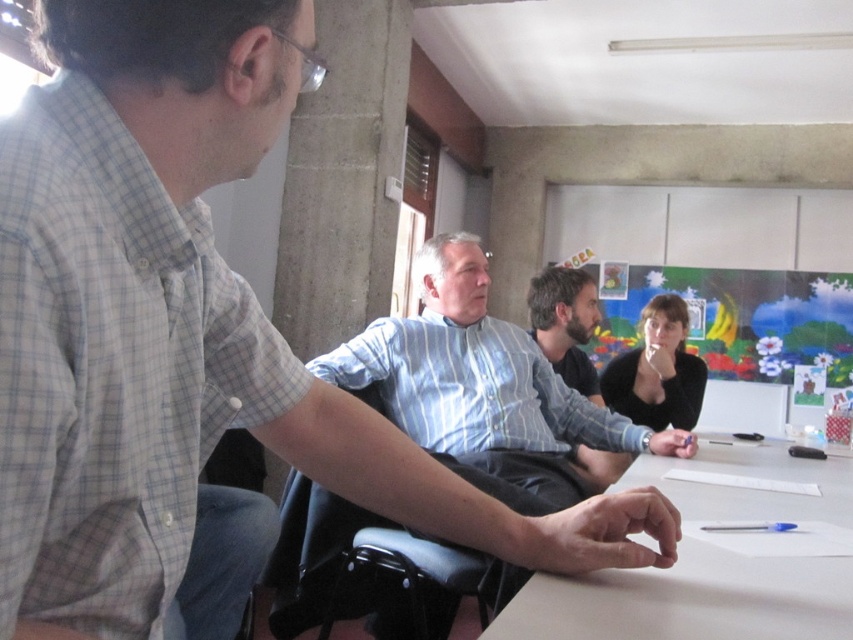
From the picture: Can you confirm if black plastic chair at center is positioned to the right of black matte shirt at center?

No, black plastic chair at center is not to the right of black matte shirt at center.

Is black plastic chair at center below black matte shirt at center?

Correct, black plastic chair at center is located below black matte shirt at center.

The image size is (853, 640). I want to click on black plastic chair at center, so click(x=357, y=568).

The height and width of the screenshot is (640, 853). I want to click on black plastic chair at center, so click(x=357, y=568).

Does black matte shirt at center have a greater width compared to bearded man at center?

Indeed, black matte shirt at center has a greater width compared to bearded man at center.

The height and width of the screenshot is (640, 853). What do you see at coordinates (657, 371) in the screenshot? I see `black matte shirt at center` at bounding box center [657, 371].

Which is behind, point (691, 390) or point (556, 362)?

Positioned behind is point (691, 390).

At what (x,y) coordinates should I click in order to perform the action: click on black matte shirt at center. Please return your answer as a coordinate pair (x, y). This screenshot has height=640, width=853. Looking at the image, I should click on (657, 371).

Is black plastic chair at center closer to the viewer compared to bearded man at center?

Yes, it is in front of bearded man at center.

Is point (444, 605) closer to viewer compared to point (560, 342)?

Yes.

Find the location of `black plastic chair at center`. black plastic chair at center is located at coordinates (357, 568).